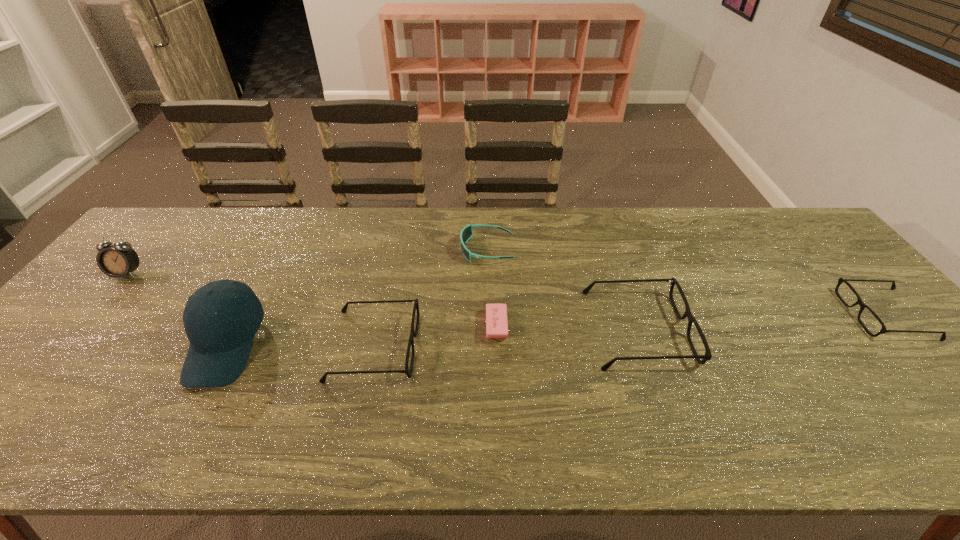
The width and height of the screenshot is (960, 540). I want to click on the closest spectacles to the second shortest spectacles, so click(691, 319).

The image size is (960, 540). I want to click on vacant space that satisfies the following two spatial constraints: 1. on the front-facing side of the sixth object from left to right; 2. on the front-facing side of the baseball cap, so click(x=643, y=346).

This screenshot has width=960, height=540. I want to click on vacant space that satisfies the following two spatial constraints: 1. on the front-facing side of the second tallest spectacles; 2. on the front-facing side of the tallest object, so click(x=373, y=346).

Locate an element on the screen. This screenshot has width=960, height=540. free spot that satisfies the following two spatial constraints: 1. on the front-facing side of the sunglasses; 2. on the face of the alarm clock is located at coordinates (488, 273).